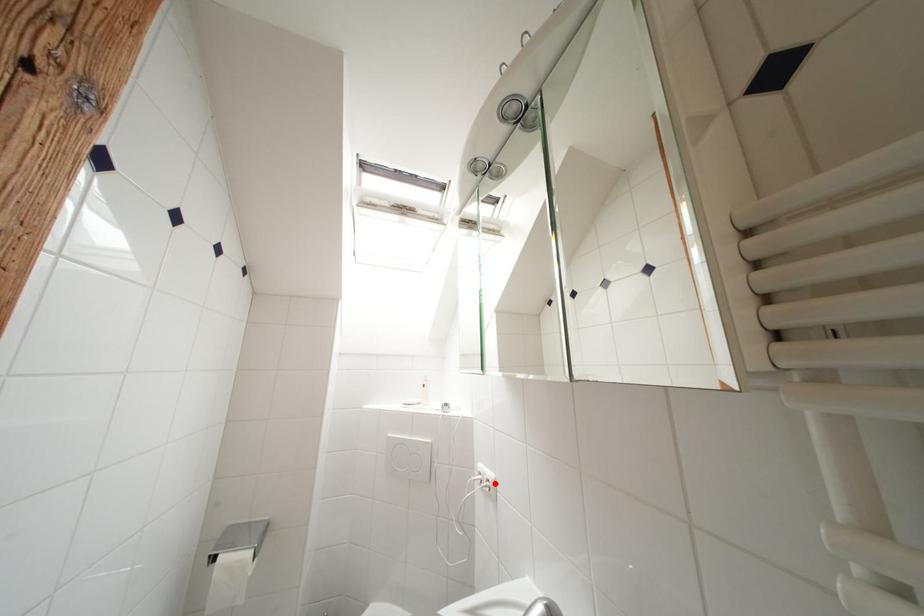
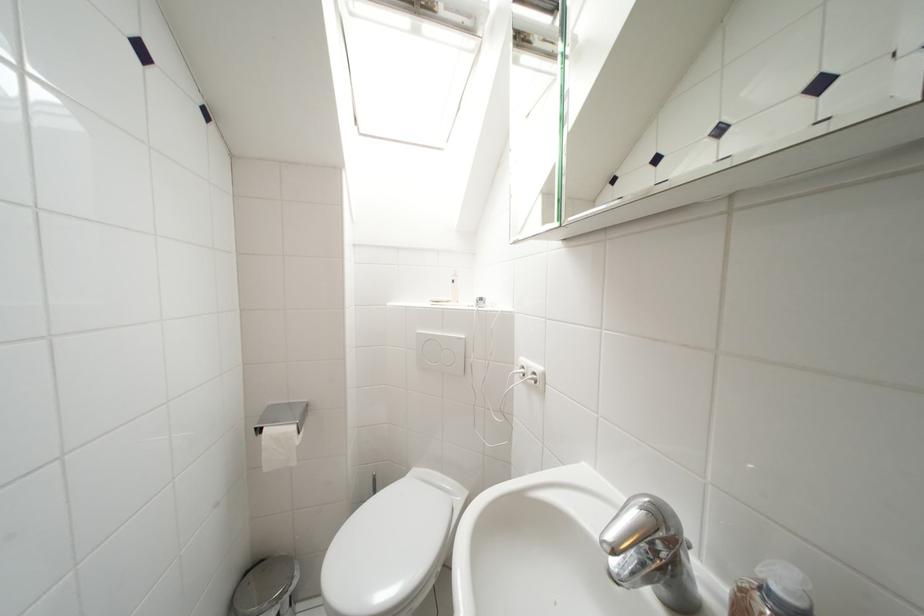
Find the pixel in the second image that matches the highlighted location in the first image.

(541, 377)